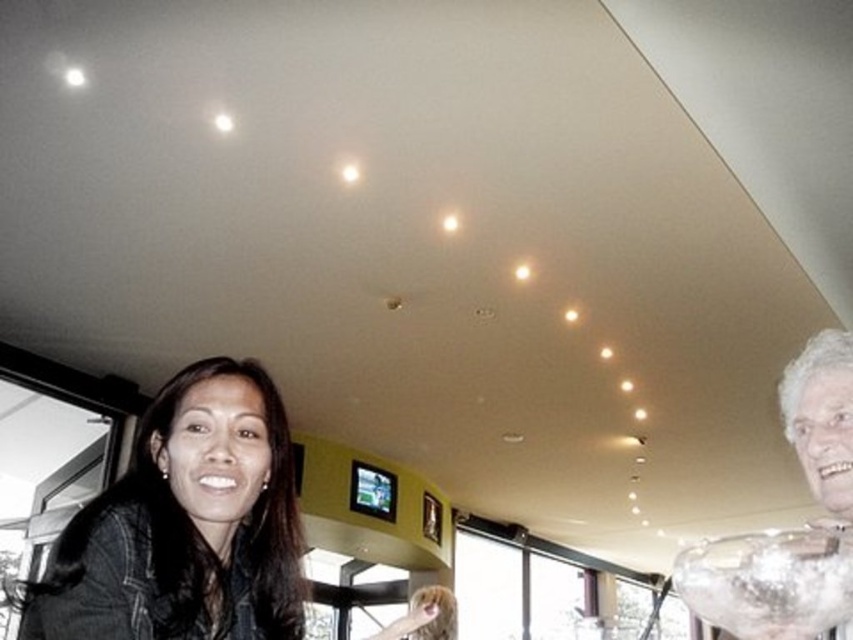
In the scene shown: You are standing in the restaurant and want to place a decorative item on the table. The table is located at the point with coordinates [793,529]. Is the white frosted glass bowl at right already placed there?

The point [793,529] indicates the white frosted glass bowl at right is already placed there.

You are a photographer trying to capture a shot of the matte black jacket at lower left and the clear glass bowl at upper right. Which object is located to the left of the other?

The matte black jacket at lower left is positioned on the left side of clear glass bowl at upper right.

You are standing in the center of the room and want to find the matte black jacket at lower left. According to the coordinates provided, in which direction should you look to locate it?

The matte black jacket at lower left is located at coordinates point (186, 524). Since the coordinates are given in a 2D system where the origin is at the bottom left corner, the x and y values increase towards the right and upwards respectively. Therefore, to locate the matte black jacket at lower left, you should look to the lower left direction from the center of the room.